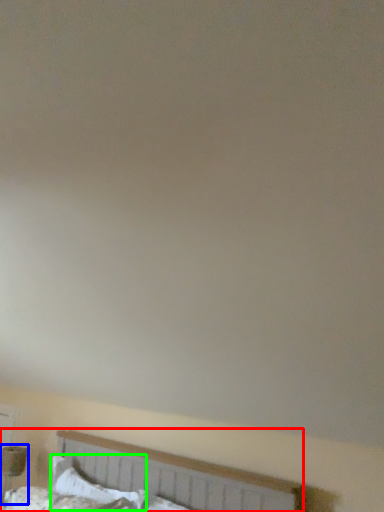
Question: Which object is the closest to the bed (highlighted by a red box)? Choose among these: table lamp (highlighted by a blue box) or pillow (highlighted by a green box).

Choices:
 (A) table lamp
 (B) pillow

Answer: (B)